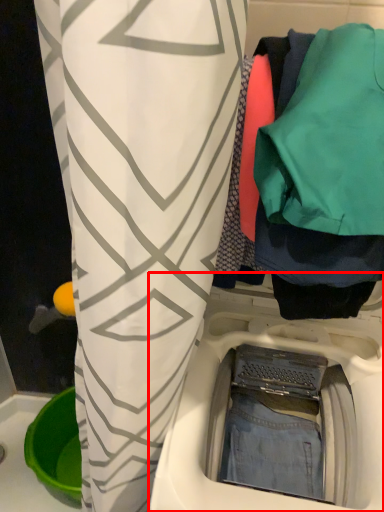
Question: In this image, where is washing machine (annotated by the red box) located relative to closet?

Choices:
 (A) right
 (B) left

Answer: (B)